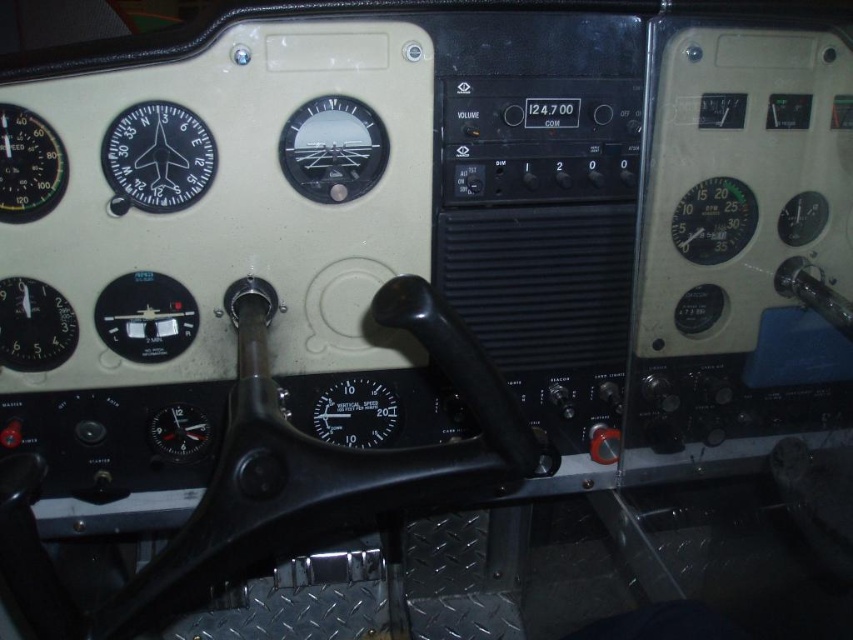
You are a pilot checking the cockpit instruments. You notice the matte black gauge at lower left and the green matte gauge at upper right. Which gauge is positioned to the left of the other?

The matte black gauge at lower left is positioned to the left of the green matte gauge at upper right.

You are a pilot checking the cockpit instruments. You notice the matte black gauge at lower left and the green matte gauge at upper right. Which of these two gauges is larger in size?

The matte black gauge at lower left is bigger than the green matte gauge at upper right.

You are a pilot checking the cockpit instruments. You notice the matte black compass at upper left and the matte black gauge at center. Which instrument is positioned more to the left side of the cockpit?

The matte black compass at upper left is positioned more to the left side of the cockpit than the matte black gauge at center.